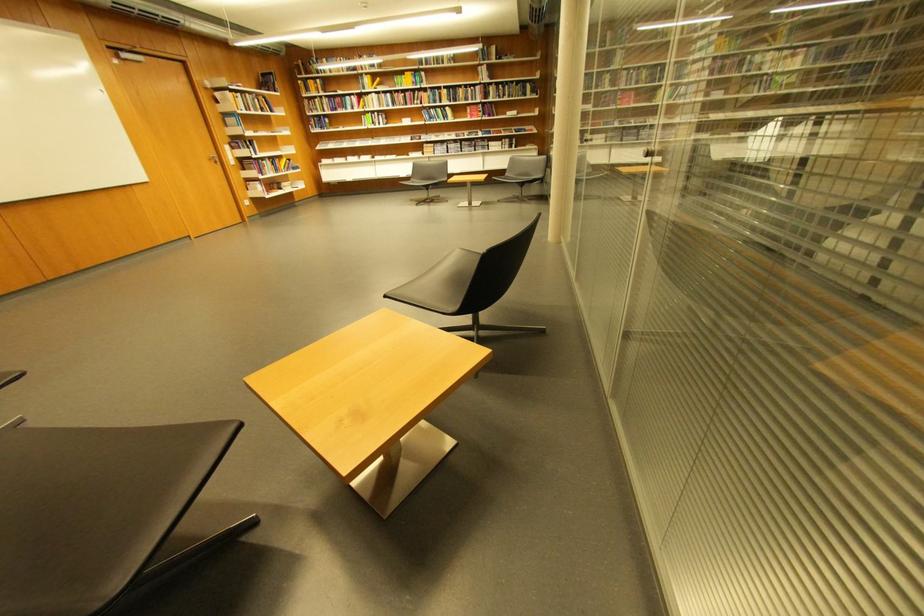
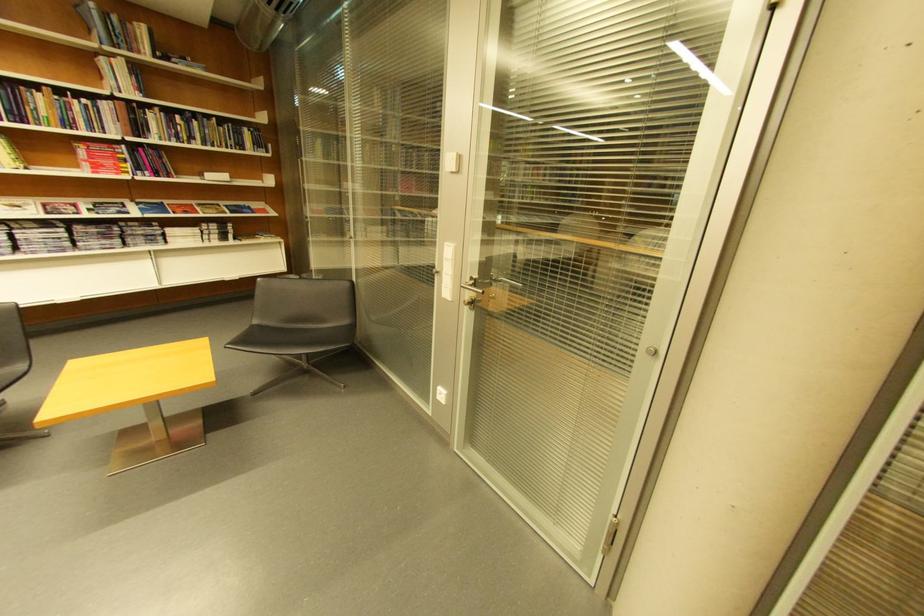
Where in the second image is the point corresponding to (x=490, y=70) from the first image?

(113, 62)